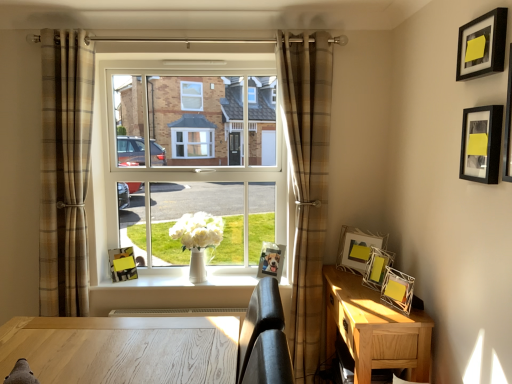
Question: Does white glossy vase at center lie behind metallic silver photo frame at center, the 5th picture frame positioned from the right?

Choices:
 (A) no
 (B) yes

Answer: (A)

Question: Does white glossy vase at center appear on the left side of metallic silver photo frame at center, which ranks as the fifth picture frame in front-to-back order?

Choices:
 (A) yes
 (B) no

Answer: (A)

Question: Does white glossy vase at center have a lesser height compared to metallic silver photo frame at center, the 5th picture frame positioned from the right?

Choices:
 (A) no
 (B) yes

Answer: (B)

Question: Considering the relative sizes of white glossy vase at center and metallic silver photo frame at center, the 2th picture frame from the back, in the image provided, is white glossy vase at center taller than metallic silver photo frame at center, the 2th picture frame from the back,?

Choices:
 (A) no
 (B) yes

Answer: (A)

Question: Can you confirm if white glossy vase at center is bigger than metallic silver photo frame at center, placed as the second picture frame when sorted from left to right?

Choices:
 (A) yes
 (B) no

Answer: (A)

Question: Is metallic silver picture frame at right, which is the fourth picture frame from back to front, in front of or behind brown plaid curtain at center, placed as the second curtain when sorted from left to right, in the image?

Choices:
 (A) behind
 (B) front

Answer: (B)

Question: In the image, is metallic silver picture frame at right, positioned as the 3th picture frame in right-to-left order, on the left side or the right side of brown plaid curtain at center, placed as the second curtain when sorted from left to right?

Choices:
 (A) right
 (B) left

Answer: (A)

Question: In terms of width, does metallic silver picture frame at right, positioned as the 3th picture frame in right-to-left order, look wider or thinner when compared to brown plaid curtain at center, the 1th curtain viewed from the right?

Choices:
 (A) thin
 (B) wide

Answer: (B)

Question: Is metallic silver picture frame at right, which is the 4th picture frame in left-to-right order, bigger or smaller than brown plaid curtain at center, the 1th curtain viewed from the right?

Choices:
 (A) small
 (B) big

Answer: (A)

Question: Would you say plaid fabric curtain at left, acting as the first curtain starting from the left, is inside or outside white wire picture frame at right, which is the 4th picture frame in right-to-left order?

Choices:
 (A) outside
 (B) inside

Answer: (A)

Question: Considering the positions of plaid fabric curtain at left, the 2th curtain from the right, and white wire picture frame at right, the third picture frame viewed from the back, in the image, is plaid fabric curtain at left, the 2th curtain from the right, taller or shorter than white wire picture frame at right, the third picture frame viewed from the back,?

Choices:
 (A) tall
 (B) short

Answer: (A)

Question: From a real-world perspective, relative to white wire picture frame at right, which is the 4th picture frame in right-to-left order, is plaid fabric curtain at left, the 2th curtain from the right, vertically above or below?

Choices:
 (A) above
 (B) below

Answer: (A)

Question: Considering their positions, is plaid fabric curtain at left, the 2th curtain from the right, located in front of or behind white wire picture frame at right, which is the 4th picture frame in right-to-left order?

Choices:
 (A) front
 (B) behind

Answer: (A)

Question: From the image's perspective, relative to light brown wood nightstand at lower right, is black matte picture frame at upper right, which is the fifth picture frame in back-to-front order, above or below?

Choices:
 (A) below
 (B) above

Answer: (B)

Question: Considering the positions of point (480, 173) and point (356, 362), is point (480, 173) closer or farther from the camera than point (356, 362)?

Choices:
 (A) farther
 (B) closer

Answer: (B)